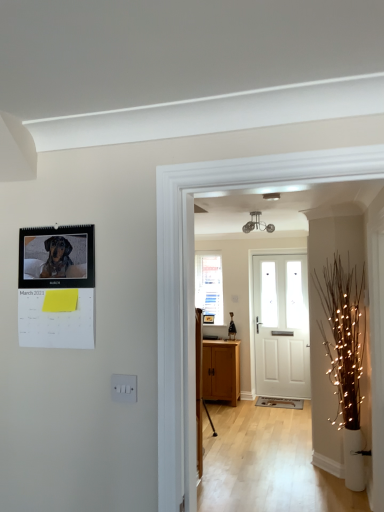
Question: Is point (200, 253) positioned closer to the camera than point (362, 397)?

Choices:
 (A) farther
 (B) closer

Answer: (A)

Question: Considering the relative positions of clear glass window at center and illuminated twig at right in the image provided, is clear glass window at center to the left or to the right of illuminated twig at right?

Choices:
 (A) left
 (B) right

Answer: (A)

Question: Which of these objects is positioned farthest from the clear glass window at center?

Choices:
 (A) illuminated twig at right
 (B) wooden cabinet at center
 (C) white painted wood door at center

Answer: (A)

Question: Which is nearer to the illuminated twig at right?

Choices:
 (A) clear glass window at center
 (B) white painted wood door at center
 (C) wooden cabinet at center

Answer: (C)